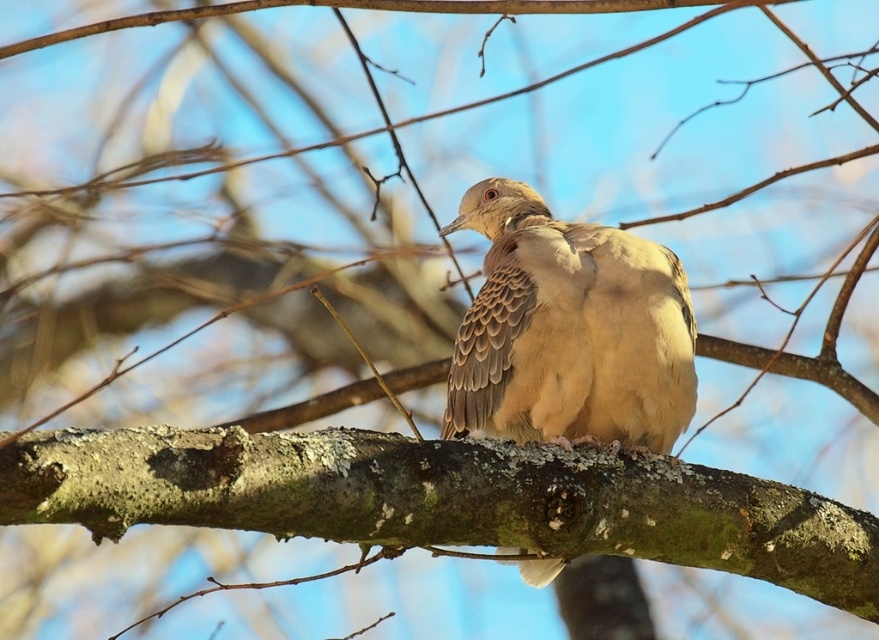
From the picture: Is green mossy branch at center below brown speckled feathers at center?

Indeed, green mossy branch at center is positioned under brown speckled feathers at center.

Who is higher up, green mossy branch at center or brown speckled feathers at center?

Positioned higher is brown speckled feathers at center.

Where is `green mossy branch at center`? This screenshot has height=640, width=879. green mossy branch at center is located at coordinates (444, 499).

Find the location of a particular element. The image size is (879, 640). green mossy branch at center is located at coordinates (444, 499).